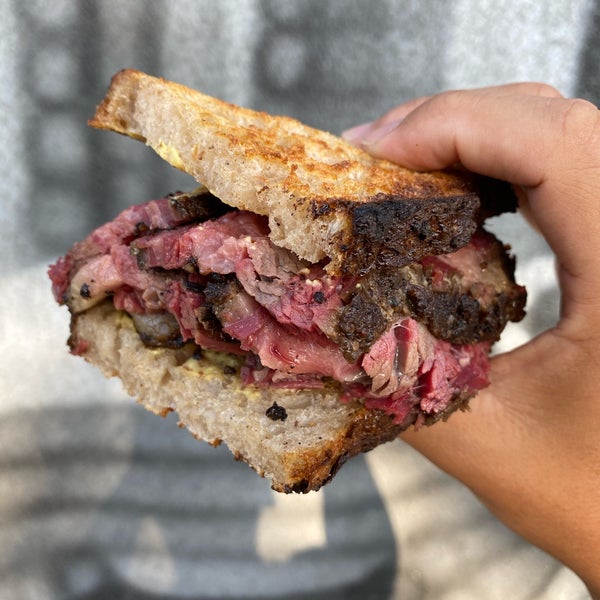
The image size is (600, 600). I want to click on crumb, so coord(275,409).